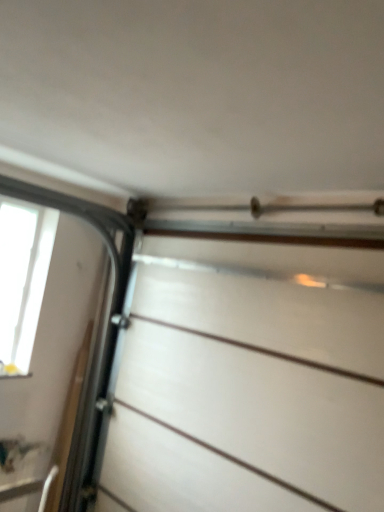
Question: Based on their sizes in the image, would you say transparent glass window at left is bigger or smaller than white matte drawer at center?

Choices:
 (A) big
 (B) small

Answer: (B)

Question: Is transparent glass window at left inside or outside of white matte drawer at center?

Choices:
 (A) outside
 (B) inside

Answer: (A)

Question: From the image's perspective, relative to white matte drawer at center, is transparent glass window at left above or below?

Choices:
 (A) above
 (B) below

Answer: (A)

Question: From the image's perspective, is white matte drawer at center located above or below transparent glass window at left?

Choices:
 (A) above
 (B) below

Answer: (B)

Question: Relative to transparent glass window at left, is white matte drawer at center in front or behind?

Choices:
 (A) front
 (B) behind

Answer: (A)

Question: Would you say white matte drawer at center is inside or outside transparent glass window at left?

Choices:
 (A) inside
 (B) outside

Answer: (B)

Question: Is white matte drawer at center to the left or to the right of transparent glass window at left in the image?

Choices:
 (A) left
 (B) right

Answer: (B)